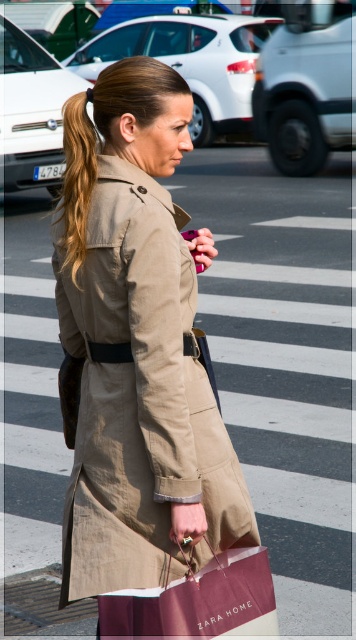
Based on the photo, you are a photographer trying to capture the woman holding the maroon paper bag at lower center and the light brown silky hair at upper left. Which object should you focus on to ensure both are in sharp focus?

The maroon paper bag at lower center is in front of the light brown silky hair at upper left. To ensure both are in sharp focus, focus on the maroon paper bag at lower center since it is closer to the camera, and the depth of field will likely include the background object as well.

You are a fashion designer observing the woman in the image. You need to determine which item is visible on top. Which is it between the tan fabric trench coat at center and the maroon paper bag at lower center?

The tan fabric trench coat at center is positioned over the maroon paper bag at lower center, so the tan fabric trench coat at center is visible on top.

You are a photographer trying to capture the woman holding the maroon paper bag at lower center and the light brown silky hair at upper left in a single frame. Which object should you focus on to ensure both are in focus, considering their positions relative to the camera?

You should focus on the light brown silky hair at upper left because it is farther from the camera than the maroon paper bag at lower center, ensuring both are in focus.